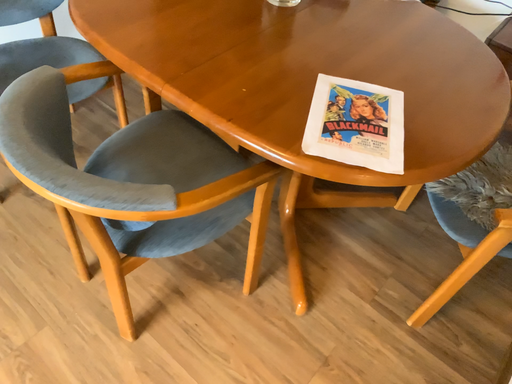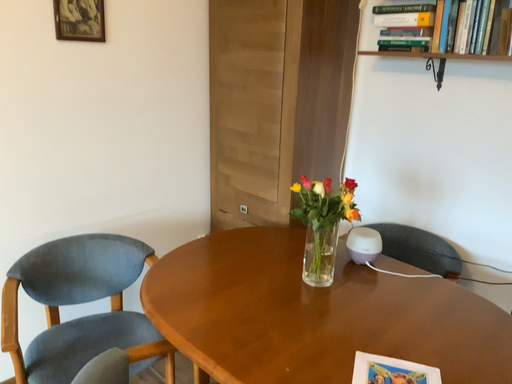
Question: How did the camera likely rotate when shooting the video?

Choices:
 (A) rotated upward
 (B) rotated downward

Answer: (A)